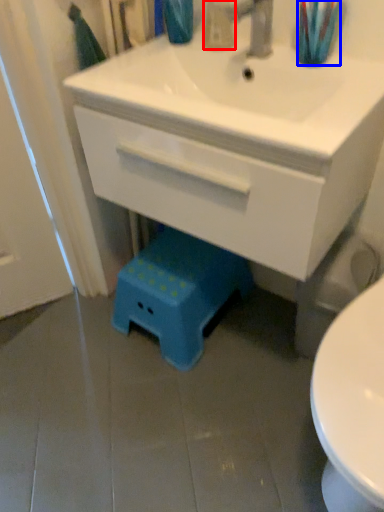
Question: Which of the following is the farthest to the observer, toiletry (highlighted by a red box) or toothbrush (highlighted by a blue box)?

Choices:
 (A) toiletry
 (B) toothbrush

Answer: (A)